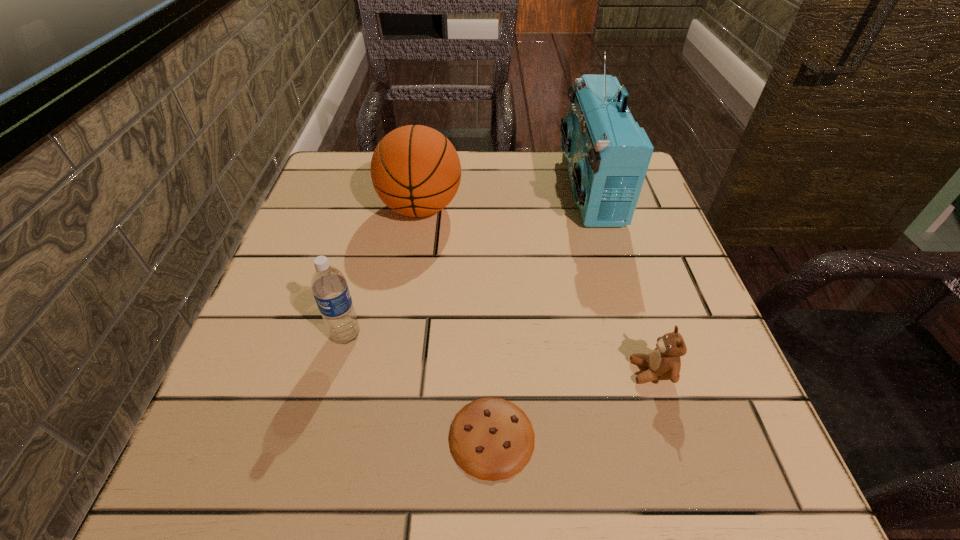
Image resolution: width=960 pixels, height=540 pixels. Find the location of `water bottle that is at the left edge`. water bottle that is at the left edge is located at coordinates (329, 287).

Where is `radio receiver that is at the right edge`? radio receiver that is at the right edge is located at coordinates (608, 154).

The height and width of the screenshot is (540, 960). In order to click on teddy bear at the right edge in this screenshot , I will do `click(664, 363)`.

The image size is (960, 540). I want to click on object located at the far left corner, so click(x=415, y=170).

You are a GUI agent. You are given a task and a screenshot of the screen. Output one action in this format:
    pyautogui.click(x=<x>, y=<y>)
    Task: Click on the object positioned at the far right corner
    This screenshot has height=540, width=960.
    Given the screenshot: What is the action you would take?
    pyautogui.click(x=608, y=154)

At what (x,y) coordinates should I click in order to perform the action: click on vacant space at the far edge of the desktop. Please return your answer as a coordinate pair (x, y). Looking at the image, I should click on (517, 200).

Locate an element on the screen. The height and width of the screenshot is (540, 960). vacant space at the near edge of the desktop is located at coordinates (437, 463).

In the image, there is a desktop. At what (x,y) coordinates should I click in order to perform the action: click on vacant space at the left edge. Please return your answer as a coordinate pair (x, y). Image resolution: width=960 pixels, height=540 pixels. Looking at the image, I should click on (372, 211).

I want to click on free space at the right edge of the desktop, so click(x=656, y=258).

At what (x,y) coordinates should I click in order to perform the action: click on vacant region at the far left corner of the desktop. Please return your answer as a coordinate pair (x, y). Looking at the image, I should click on (325, 179).